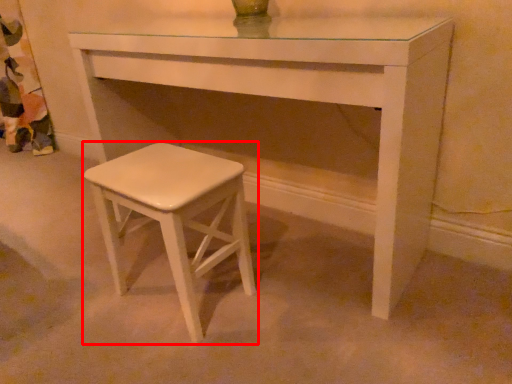
Question: From the image's perspective, where is stool (annotated by the red box) located relative to table?

Choices:
 (A) below
 (B) above

Answer: (A)